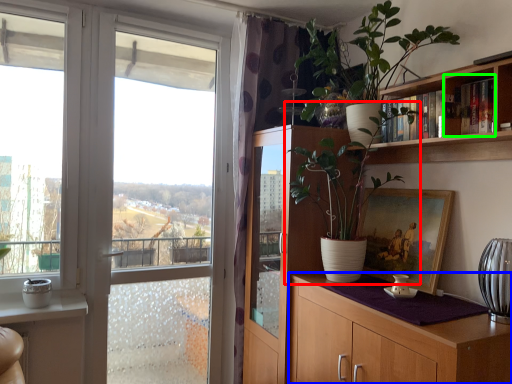
Question: Which is farther away from houseplant (highlighted by a red box)? cabinetry (highlighted by a blue box) or cabinet (highlighted by a green box)?

Choices:
 (A) cabinetry
 (B) cabinet

Answer: (B)